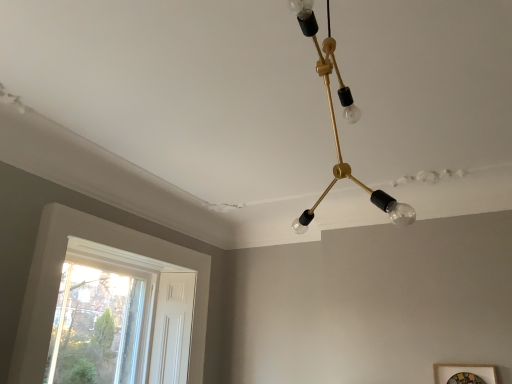
The image size is (512, 384). I want to click on wooden picture frame at lower right, so click(x=464, y=372).

Image resolution: width=512 pixels, height=384 pixels. What do you see at coordinates (464, 372) in the screenshot?
I see `wooden picture frame at lower right` at bounding box center [464, 372].

At what (x,y) coordinates should I click in order to perform the action: click on white wood window at lower left. Please return your answer as a coordinate pair (x, y). The image size is (512, 384). Looking at the image, I should click on (97, 326).

Based on the photo, measure the distance between white wood window at lower left and camera.

white wood window at lower left is 9.86 feet away from camera.

This screenshot has width=512, height=384. What do you see at coordinates (336, 126) in the screenshot?
I see `gold metallic chandelier at upper center` at bounding box center [336, 126].

Locate an element on the screen. wooden picture frame at lower right is located at coordinates (464, 372).

Considering the sizes of wooden picture frame at lower right and gold metallic chandelier at upper center in the image, is wooden picture frame at lower right bigger or smaller than gold metallic chandelier at upper center?

Clearly, wooden picture frame at lower right is smaller in size than gold metallic chandelier at upper center.

Are wooden picture frame at lower right and gold metallic chandelier at upper center far apart?

Yes.

Is gold metallic chandelier at upper center at the back of wooden picture frame at lower right?

No, wooden picture frame at lower right is not facing the opposite direction of gold metallic chandelier at upper center.

How different are the orientations of wooden picture frame at lower right and gold metallic chandelier at upper center in degrees?

The angle between the facing direction of wooden picture frame at lower right and the facing direction of gold metallic chandelier at upper center is 1.56 degrees.

Which is correct: wooden picture frame at lower right is inside white wood window at lower left, or outside of it?

The correct answer is: outside.

Between point (463, 366) and point (75, 373), which one is positioned in front?

The point (463, 366) is closer to the camera.

Which of these two, wooden picture frame at lower right or white wood window at lower left, is smaller?

wooden picture frame at lower right is smaller.

Could you tell me if wooden picture frame at lower right is turned towards white wood window at lower left?

No, wooden picture frame at lower right is not facing towards white wood window at lower left.

Is point (81, 270) farther from viewer compared to point (327, 89)?

Yes, point (81, 270) is behind point (327, 89).

What's the angular difference between white wood window at lower left and gold metallic chandelier at upper center's facing directions?

The angle between the facing direction of white wood window at lower left and the facing direction of gold metallic chandelier at upper center is 89.7 degrees.

Consider the image. Which object is thinner, white wood window at lower left or gold metallic chandelier at upper center?

Thinner between the two is white wood window at lower left.

Is white wood window at lower left next to gold metallic chandelier at upper center?

No, white wood window at lower left is not in contact with gold metallic chandelier at upper center.

Based on the photo, looking at their sizes, would you say gold metallic chandelier at upper center is wider or thinner than white wood window at lower left?

gold metallic chandelier at upper center is wider than white wood window at lower left.

From a real-world perspective, between gold metallic chandelier at upper center and white wood window at lower left, who is vertically higher?

From a 3D spatial view, gold metallic chandelier at upper center is above.

Is gold metallic chandelier at upper center outside of white wood window at lower left?

That's correct, gold metallic chandelier at upper center is outside of white wood window at lower left.

Is gold metallic chandelier at upper center beside wooden picture frame at lower right?

No, gold metallic chandelier at upper center is not in contact with wooden picture frame at lower right.

From the image's perspective, is gold metallic chandelier at upper center beneath wooden picture frame at lower right?

Actually, gold metallic chandelier at upper center appears above wooden picture frame at lower right in the image.

Does gold metallic chandelier at upper center appear on the left side of wooden picture frame at lower right?

Yes, gold metallic chandelier at upper center is to the left of wooden picture frame at lower right.

This screenshot has width=512, height=384. In order to click on picture frame located on the right of gold metallic chandelier at upper center in this screenshot , I will do `click(464, 372)`.

Based on their sizes in the image, would you say white wood window at lower left is bigger or smaller than wooden picture frame at lower right?

In the image, white wood window at lower left appears to be larger than wooden picture frame at lower right.

From the image's perspective, which is above, white wood window at lower left or wooden picture frame at lower right?

white wood window at lower left appears higher in the image.

Is white wood window at lower left far away from wooden picture frame at lower right?

Yes, white wood window at lower left is far from wooden picture frame at lower right.

Which is behind, point (115, 305) or point (481, 366)?

Point (115, 305)

The image size is (512, 384). Find the location of `lamp on the left side of wooden picture frame at lower right`. lamp on the left side of wooden picture frame at lower right is located at coordinates tap(336, 126).

Locate an element on the screen. This screenshot has width=512, height=384. picture frame lying in front of the white wood window at lower left is located at coordinates (464, 372).

When comparing their distances from wooden picture frame at lower right, does gold metallic chandelier at upper center or white wood window at lower left seem further?

Among the two, white wood window at lower left is located further to wooden picture frame at lower right.

From the picture: From the image, which object appears to be farther from white wood window at lower left, gold metallic chandelier at upper center or wooden picture frame at lower right?

The object further to white wood window at lower left is gold metallic chandelier at upper center.

When comparing their distances from white wood window at lower left, does wooden picture frame at lower right or gold metallic chandelier at upper center seem further?

Among the two, gold metallic chandelier at upper center is located further to white wood window at lower left.

Looking at this image, estimate the real-world distances between objects in this image. Which object is closer to gold metallic chandelier at upper center, wooden picture frame at lower right or white wood window at lower left?

wooden picture frame at lower right is positioned closer to the anchor gold metallic chandelier at upper center.

Which object lies nearer to the anchor point wooden picture frame at lower right, white wood window at lower left or gold metallic chandelier at upper center?

The object closer to wooden picture frame at lower right is gold metallic chandelier at upper center.

Looking at the image, which one is located further to gold metallic chandelier at upper center, white wood window at lower left or wooden picture frame at lower right?

white wood window at lower left is further to gold metallic chandelier at upper center.

The height and width of the screenshot is (384, 512). Identify the location of lamp situated between white wood window at lower left and wooden picture frame at lower right from left to right. (336, 126).